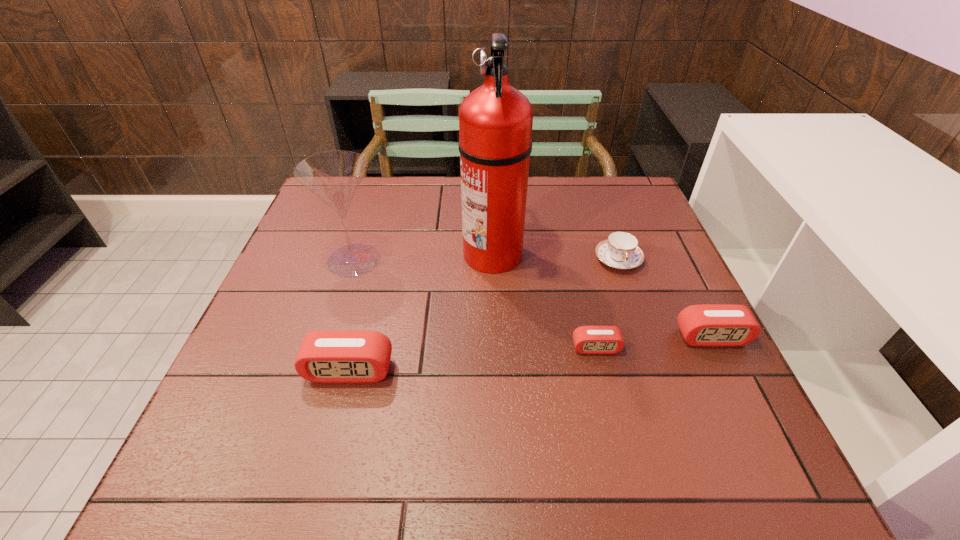
Identify which alarm clock is the nearest to the shortest alarm clock. Please provide its 2D coordinates. Your answer should be formatted as a tuple, i.e. [(x, y)], where the tuple contains the x and y coordinates of a point satisfying the conditions above.

[(716, 325)]

The image size is (960, 540). I want to click on alarm clock that stands as the closest to the third object from left to right, so click(587, 339).

Locate an element on the screen. The height and width of the screenshot is (540, 960). free location that satisfies the following two spatial constraints: 1. at the nozzle of the fire extinguisher; 2. on the front-facing side of the leftmost alarm clock is located at coordinates (496, 370).